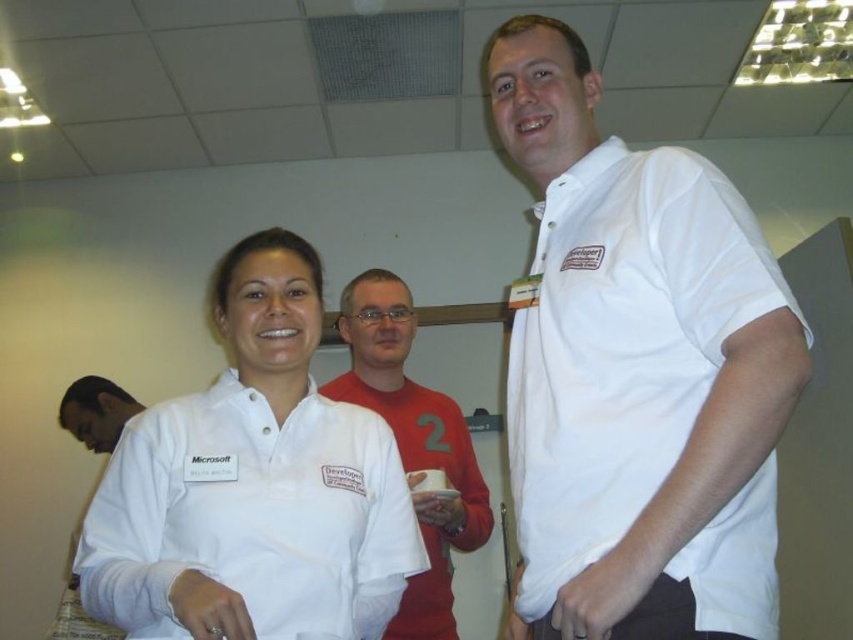
You are a delivery person who needs to place a package between the white cotton shirt at upper right and the dark skin smooth face at lower left. The package is 6 feet long. Will it fit in the space between them?

The distance between the white cotton shirt at upper right and the dark skin smooth face at lower left is 6.34 feet, so the 6 feet long package will fit in the space between them.

You are organizing a clothing donation drive and need to decide which items can fit into a small donation box. The box can only accommodate items that take up less space. Which of the two items, the white cotton shirt at upper right or the red matte shirt at center, should you choose to place in the box?

The white cotton shirt at upper right occupies less space than the red matte shirt at center, so it should be chosen for the donation box.

You are standing in the office scene and need to hand a document to the person wearing the white cotton shirt at upper right and the red matte shirt at center. Which one can you reach first without moving closer?

The white cotton shirt at upper right is closer to the viewer than the red matte shirt at center, so you can reach the person wearing the white cotton shirt at upper right first without moving closer.